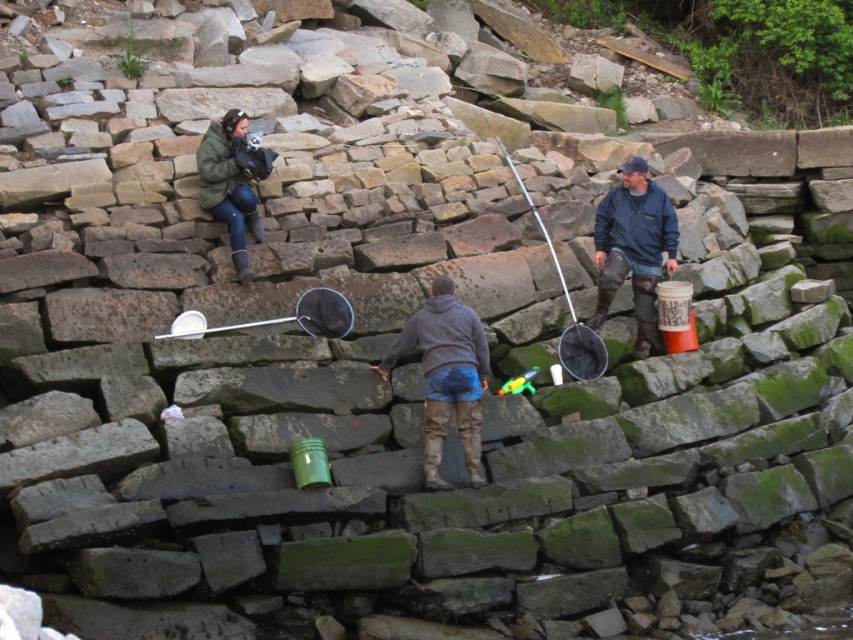
Question: Which of the following is the farthest from the observer?

Choices:
 (A) gray fleece jacket at center
 (B) blue fleece jacket at center

Answer: (B)

Question: Observing the image, what is the correct spatial positioning of gray fleece jacket at center in reference to green matte jacket at upper left?

Choices:
 (A) right
 (B) left

Answer: (A)

Question: Which object appears closest to the camera in this image?

Choices:
 (A) blue fleece jacket at center
 (B) green matte jacket at upper left
 (C) gray fleece jacket at center

Answer: (C)

Question: Can you confirm if blue fleece jacket at center is smaller than green matte jacket at upper left?

Choices:
 (A) yes
 (B) no

Answer: (A)

Question: Among these objects, which one is nearest to the camera?

Choices:
 (A) green matte jacket at upper left
 (B) blue fleece jacket at center

Answer: (A)

Question: Does gray fleece jacket at center have a larger size compared to blue fleece jacket at center?

Choices:
 (A) yes
 (B) no

Answer: (A)